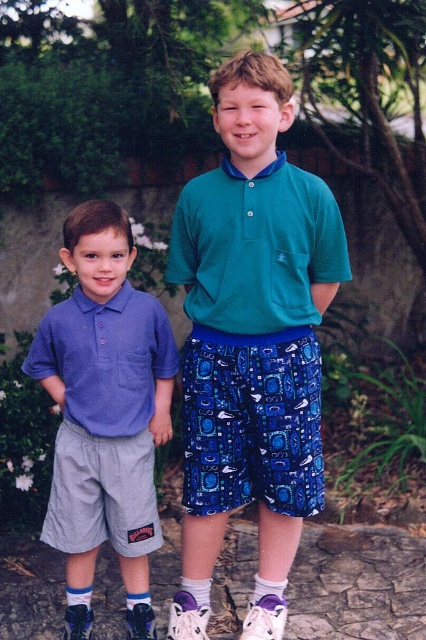
Question: Does teal cotton polo shirt at center have a larger size compared to gray stone at lower center?

Choices:
 (A) yes
 (B) no

Answer: (A)

Question: Which point appears closest to the camera in this image?

Choices:
 (A) (187, 250)
 (B) (62, 509)

Answer: (A)

Question: Is green matte polo shirt at center bigger than matte blue polo shirt at center?

Choices:
 (A) yes
 (B) no

Answer: (A)

Question: Estimate the real-world distances between objects in this image. Which object is closer to the matte blue polo shirt at center?

Choices:
 (A) matte blue shirt at center
 (B) teal cotton polo shirt at center
 (C) green matte polo shirt at center

Answer: (A)

Question: Which object is closer to the camera taking this photo?

Choices:
 (A) matte blue polo shirt at center
 (B) purple fabric sock at lower center
 (C) gray cotton shorts at left

Answer: (A)

Question: Is gray stone at lower center below white cotton sock at lower center?

Choices:
 (A) no
 (B) yes

Answer: (B)